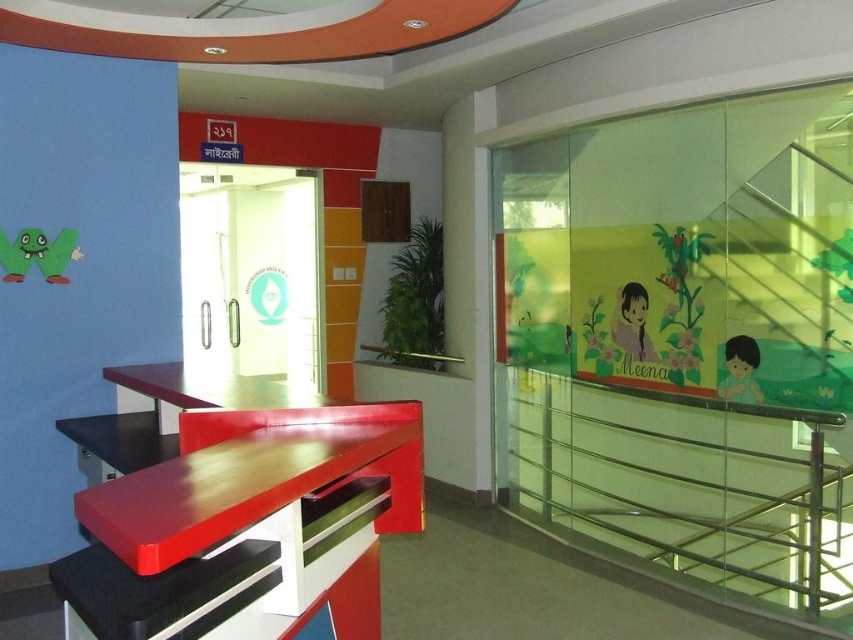
You are a parent entering the room and see the clear glass balustrade at right and the matte yellow child at right. Which object is larger in size?

The clear glass balustrade at right is bigger than the matte yellow child at right according to the description.

Looking at this image, you are a visitor entering the room and want to locate the clear glass balustrade at right. According to the scene, where would you find it in relation to the pastel pink paper at upper right?

The clear glass balustrade at right is positioned under the pastel pink paper at upper right, so you would find it below the pastel pink paper at upper right.